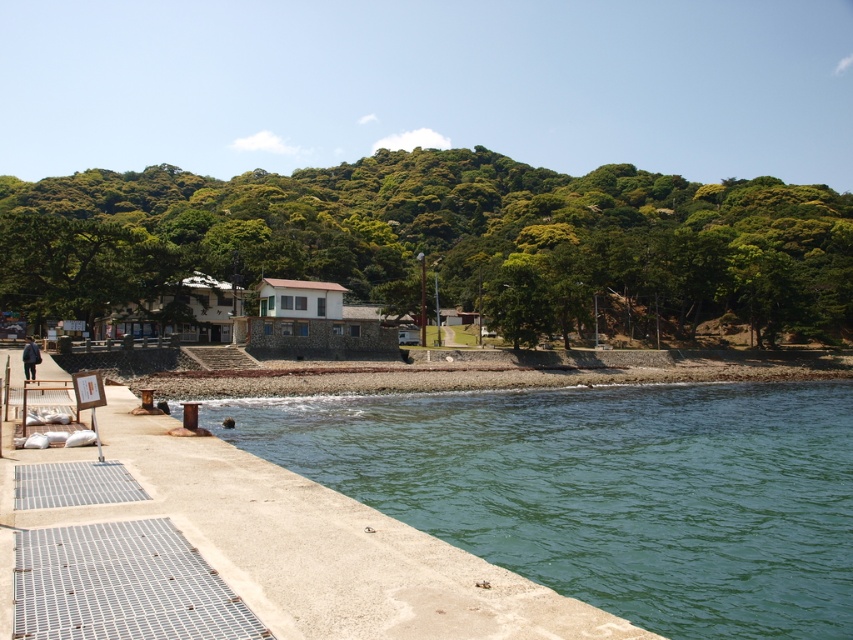
Question: Which object is closer to the camera taking this photo?

Choices:
 (A) green concrete water at lower left
 (B) green leafy hillside at center

Answer: (A)

Question: Is green leafy hillside at center to the left of green concrete water at lower left from the viewer's perspective?

Choices:
 (A) no
 (B) yes

Answer: (B)

Question: Is green leafy hillside at center above green concrete water at lower left?

Choices:
 (A) no
 (B) yes

Answer: (B)

Question: Which of the following is the farthest from the observer?

Choices:
 (A) 572,433
 (B) 813,266

Answer: (B)

Question: Which of the following is the farthest from the observer?

Choices:
 (A) (804, 298)
 (B) (788, 406)

Answer: (A)

Question: Can you confirm if green leafy hillside at center is thinner than green concrete water at lower left?

Choices:
 (A) no
 (B) yes

Answer: (A)